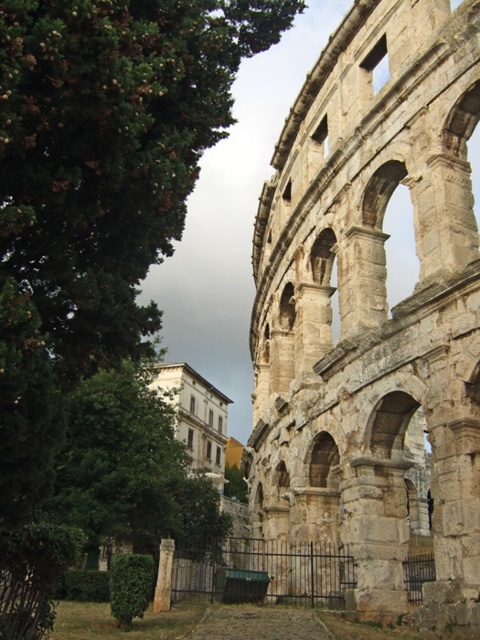
Question: Which point is farther to the camera?

Choices:
 (A) smooth stone pillar at center
 (B) green leafy tree at upper left

Answer: (A)

Question: Is stone arches at right above green leafy tree at center?

Choices:
 (A) yes
 (B) no

Answer: (A)

Question: Which of the following is the closest to the observer?

Choices:
 (A) pos(162,522)
 (B) pos(144,189)

Answer: (B)

Question: Is green leafy tree at upper left closer to camera compared to green leafy tree at center?

Choices:
 (A) yes
 (B) no

Answer: (A)

Question: Among these objects, which one is nearest to the camera?

Choices:
 (A) green leafy tree at upper left
 (B) smooth stone pillar at center
 (C) green leafy tree at center
 (D) stone arches at right

Answer: (A)

Question: Can you confirm if stone arches at right is thinner than smooth stone pillar at center?

Choices:
 (A) no
 (B) yes

Answer: (A)